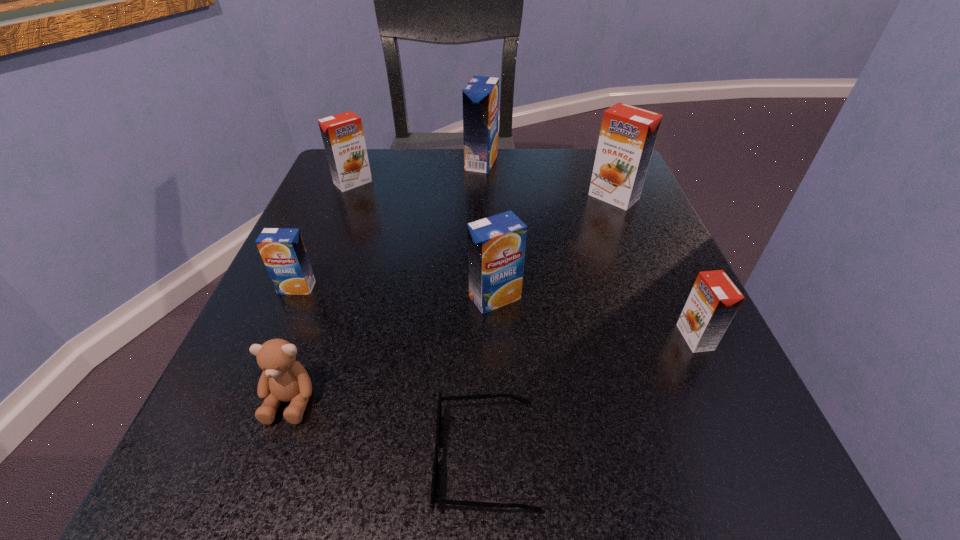
Identify the location of object that is at the near edge. Image resolution: width=960 pixels, height=540 pixels. 478,396.

Identify the location of teddy bear present at the left edge. The image size is (960, 540). (283, 379).

Identify the location of object at the far left corner. (342, 134).

Identify the location of object that is positioned at the far right corner. (628, 134).

The image size is (960, 540). Identify the location of vacant space at the far edge of the desktop. (546, 149).

At what (x,y) coordinates should I click in order to perform the action: click on blank area at the left edge. Please return your answer as a coordinate pair (x, y). This screenshot has height=540, width=960. Looking at the image, I should click on (329, 286).

The image size is (960, 540). I want to click on vacant area at the right edge, so click(705, 431).

You are a GUI agent. You are given a task and a screenshot of the screen. Output one action in this format:
    pyautogui.click(x=<x>, y=<y>)
    Task: Click on the vacant region at the near right corner
    
    Given the screenshot: What is the action you would take?
    pyautogui.click(x=736, y=499)

Identify the location of vacant area between the nearest orange orange juice and the leftmost blue orange_juice. (496, 312).

Locate an element on the screen. This screenshot has width=960, height=540. free point between the farthest blue orange_juice and the teddy bear is located at coordinates (386, 281).